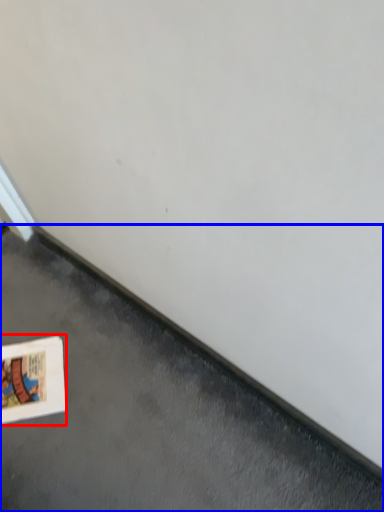
Question: Which object is closer to the camera taking this photo, picture frame (highlighted by a red box) or concrete (highlighted by a blue box)?

Choices:
 (A) picture frame
 (B) concrete

Answer: (B)